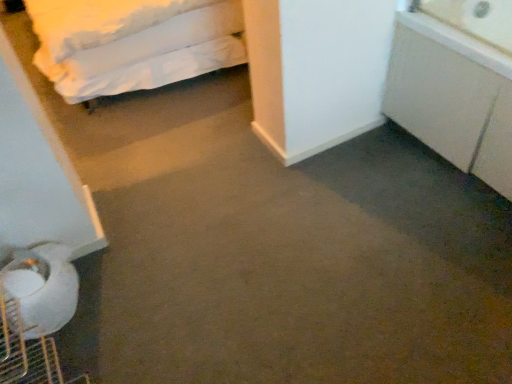
Question: Is white matte cabinet at right spatially inside white soft bed at upper left, or outside of it?

Choices:
 (A) inside
 (B) outside

Answer: (B)

Question: From the image's perspective, is white matte cabinet at right located above or below white soft bed at upper left?

Choices:
 (A) below
 (B) above

Answer: (A)

Question: In terms of height, does white matte cabinet at right look taller or shorter compared to white soft bed at upper left?

Choices:
 (A) tall
 (B) short

Answer: (B)

Question: Considering the positions of white soft bed at upper left and white matte cabinet at right in the image, is white soft bed at upper left wider or thinner than white matte cabinet at right?

Choices:
 (A) thin
 (B) wide

Answer: (B)

Question: Visually, is white soft bed at upper left positioned to the left or to the right of white matte cabinet at right?

Choices:
 (A) right
 (B) left

Answer: (B)

Question: Based on their sizes in the image, would you say white soft bed at upper left is bigger or smaller than white matte cabinet at right?

Choices:
 (A) small
 (B) big

Answer: (B)

Question: From the image's perspective, is white soft bed at upper left positioned above or below white matte cabinet at right?

Choices:
 (A) above
 (B) below

Answer: (A)